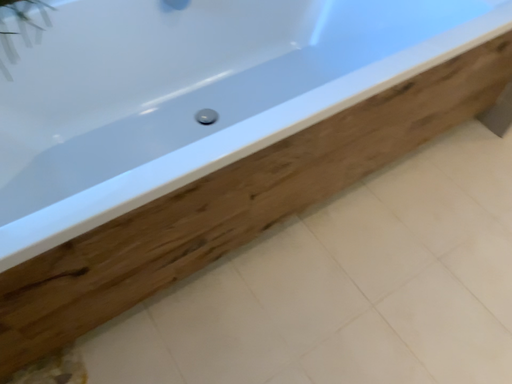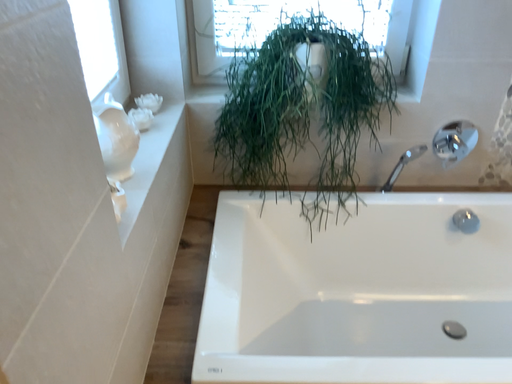
Question: Which way did the camera rotate in the video?

Choices:
 (A) rotated left
 (B) rotated right

Answer: (A)